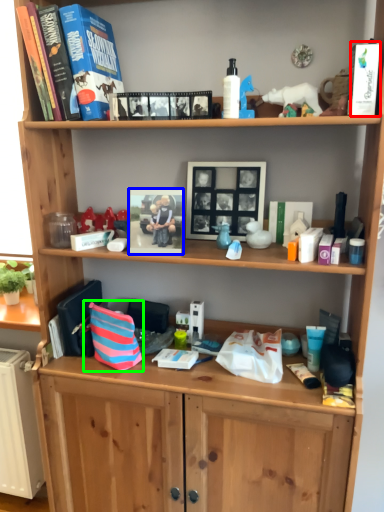
Question: Considering the real-world distances, which object is farthest from paperback book (highlighted by a red box)? picture frame (highlighted by a blue box) or shopping bag (highlighted by a green box)?

Choices:
 (A) picture frame
 (B) shopping bag

Answer: (B)